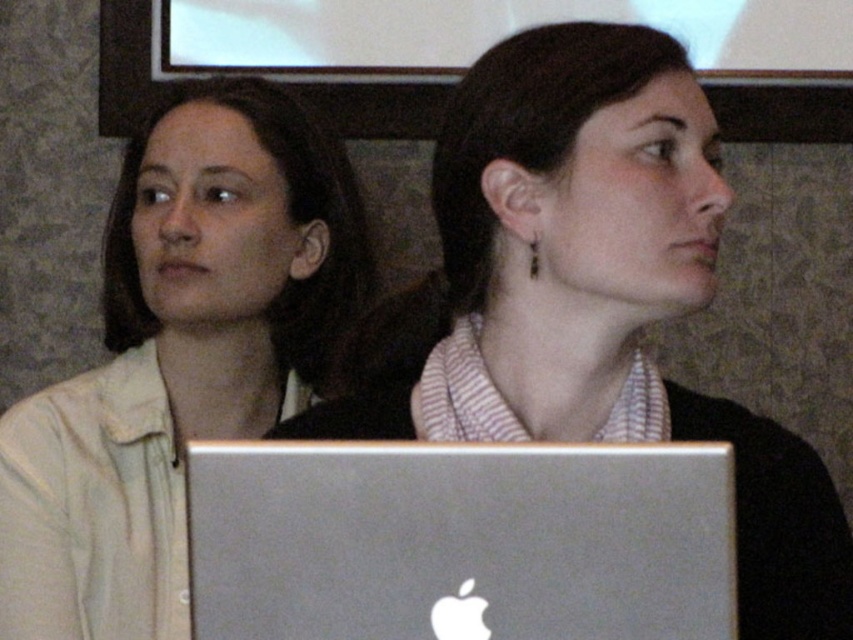
You are organizing a tech event and need to set up equipment. You have a metallic silver laptop at center and a matte beige shirt at left. According to the image, which object is positioned higher?

The metallic silver laptop at center is located above the matte beige shirt at left, so it is positioned higher.

You are an assistant organizing a conference room. You see two laptops labeled metallic silver laptop at center and silver metallic laptop at center. Which one is positioned higher?

The metallic silver laptop at center is located above the silver metallic laptop at center, so it is positioned higher.